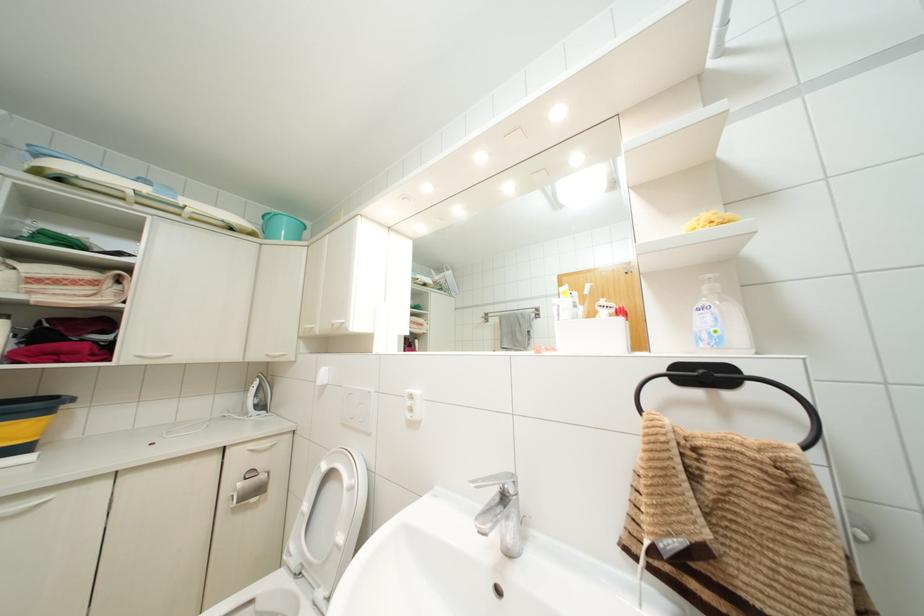
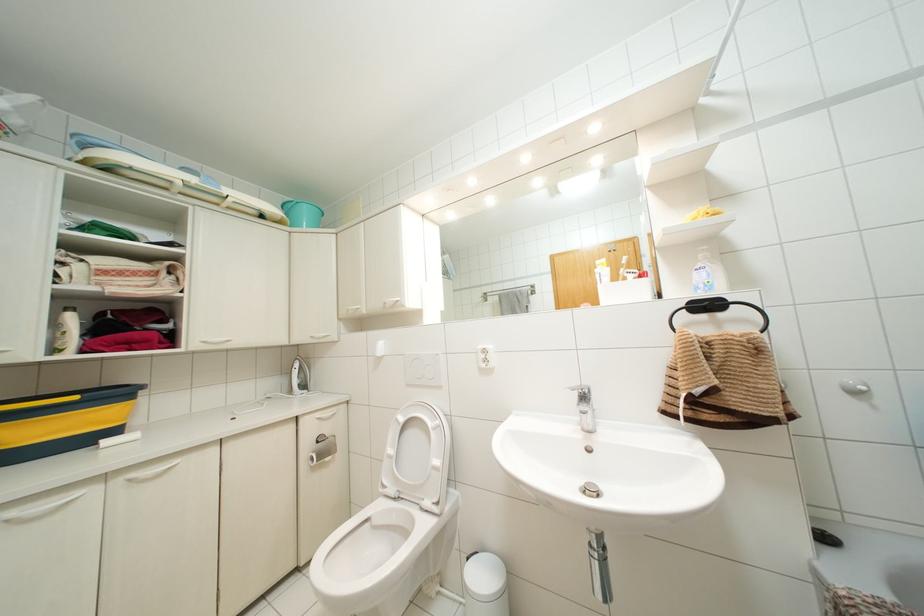
Where in the second image is the point corresponding to (x=252, y=499) from the first image?

(326, 459)